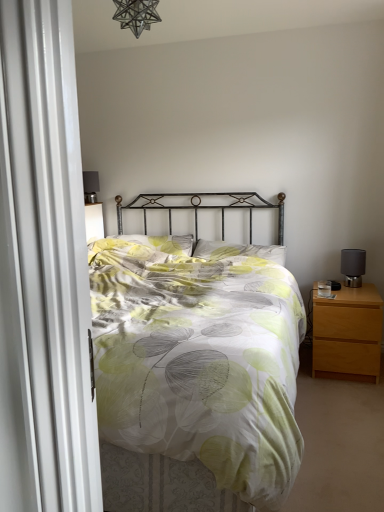
Question: Considering their positions, is matte black table lamp at right located in front of or behind light green fabric pillow at center, the first pillow when ordered from left to right?

Choices:
 (A) front
 (B) behind

Answer: (A)

Question: Is matte black table lamp at right spatially inside light green fabric pillow at center, the first pillow when ordered from left to right, or outside of it?

Choices:
 (A) inside
 (B) outside

Answer: (B)

Question: Based on their relative distances, which object is farther from the light brown wood nightstand at right?

Choices:
 (A) light green fabric pillow at center, the first pillow when ordered from left to right
 (B) metallic star-shaped light fixture at upper center
 (C) matte black table lamp at right
 (D) white fabric pillow at center, acting as the 2th pillow starting from the left
 (E) printed fabric bed at center

Answer: (B)

Question: Estimate the real-world distances between objects in this image. Which object is farther from the light brown wood nightstand at right?

Choices:
 (A) light green fabric pillow at center, the first pillow when ordered from left to right
 (B) matte black table lamp at right
 (C) printed fabric bed at center
 (D) metallic star-shaped light fixture at upper center
 (E) white fabric pillow at center, which is the first pillow from right to left

Answer: (D)